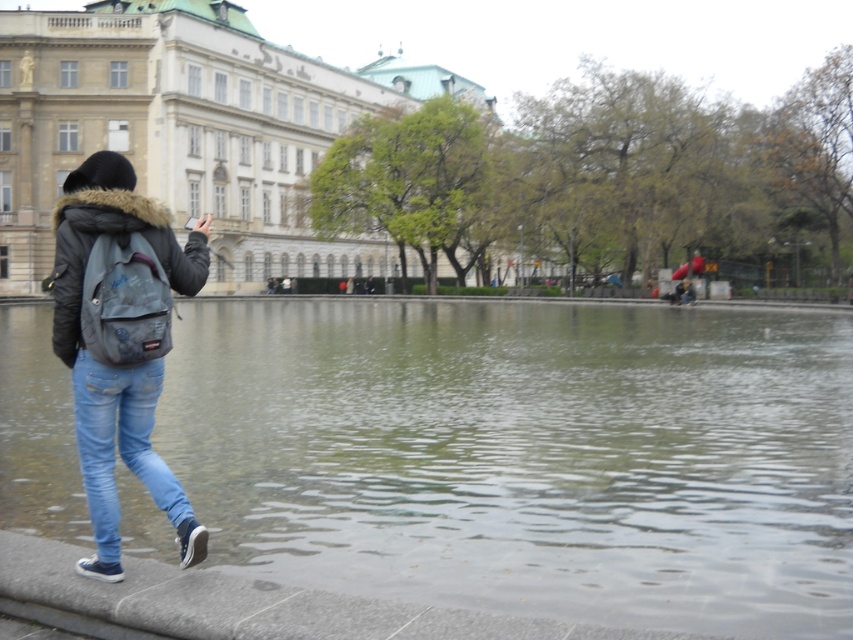
You are standing at the point with coordinates point (467,307) and want to walk towards the point (86,257). Based on the scene description, will you be moving towards the ornate building or away from it?

Since point (467,307) is further to the viewer than point (86,257), moving from point (467,307) towards point (86,257) means you are moving away from the ornate building in the background.

You are standing at the point with coordinates point (x=39, y=77) and want to walk towards the large ornate building in the background. Is the point point (x=399, y=328) in your path?

Point (x=399, y=328) is closer to the viewer than point (x=39, y=77), so yes, the point (x=399, y=328) is in your path towards the large ornate building in the background.

You are a photographer trying to capture the entire scene in one shot. You notice two points marked in the image at coordinates point (218, 32) and point (140, 301). Which point is closer to your camera lens?

Point (218, 32) is further to the camera than point (140, 301), so the point closer to the camera lens is point (140, 301).